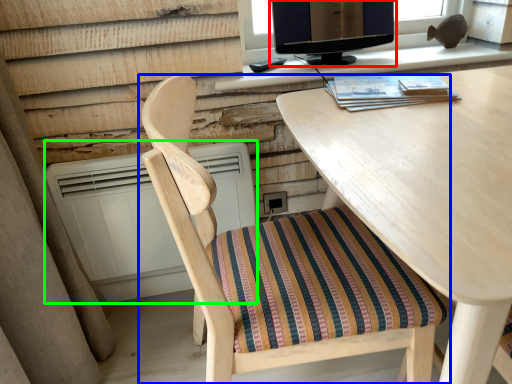
Question: Which object is positioned closest to computer monitor (highlighted by a red box)? Select from chair (highlighted by a blue box) and air conditioner (highlighted by a green box).

Choices:
 (A) chair
 (B) air conditioner

Answer: (B)